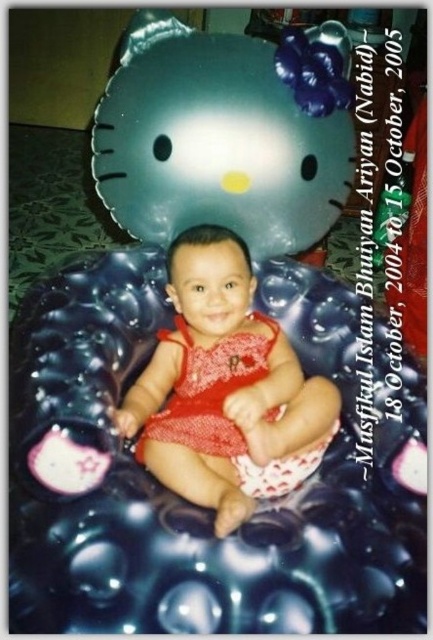
Question: Which point is farther from the camera taking this photo?

Choices:
 (A) (170, 104)
 (B) (141, 380)

Answer: (B)

Question: Is matte blue balloon at upper center closer to camera compared to red knitted dress at center?

Choices:
 (A) no
 (B) yes

Answer: (A)

Question: Which point is closer to the camera?

Choices:
 (A) (180, 220)
 (B) (252, 356)

Answer: (B)

Question: Does matte blue balloon at upper center have a greater width compared to red knitted dress at center?

Choices:
 (A) yes
 (B) no

Answer: (A)

Question: Can you confirm if matte blue balloon at upper center is positioned below red knitted dress at center?

Choices:
 (A) yes
 (B) no

Answer: (B)